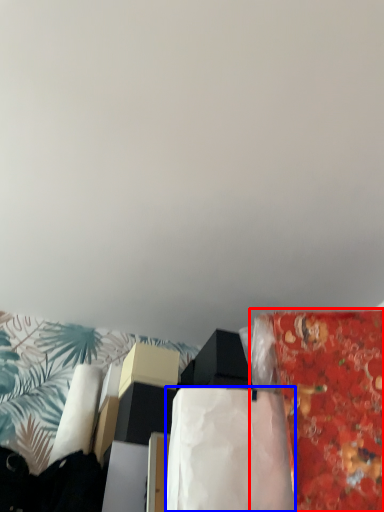
Question: Which object is closer to the camera taking this photo, material (highlighted by a red box) or blanket (highlighted by a blue box)?

Choices:
 (A) material
 (B) blanket

Answer: (A)